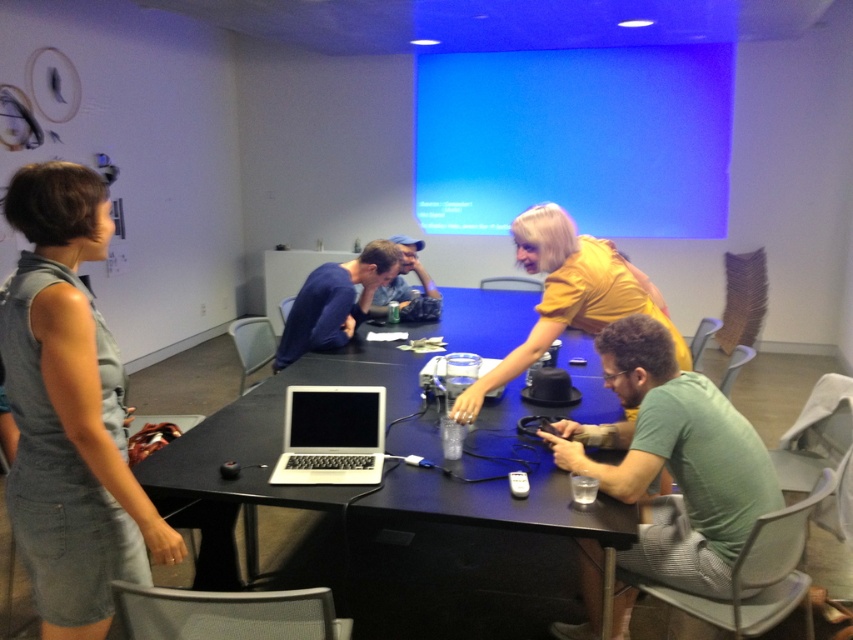
You are an office assistant who needs to place a new document on the black plastic table at center. However, there is a denim jacket at center in the way. Can you place the document directly on the table without moving the jacket?

The black plastic table at center is located below denim jacket at center, so the denim jacket is on top of the table. Therefore, you cannot place the document directly on the table without moving the jacket.

You are a person who wants to place a 15 cm tall object on the surface of the black plastic table at center. However, there is a clear plastic projector at center on the table. Will the object fit on the table without being blocked by the projector?

The black plastic table at center is much taller than the clear plastic projector at center, so placing a 15 cm tall object on the table surface would not be blocked by the projector since the table itself is taller. However, the actual space availability depends on the horizontal placement and not the vertical height difference.

You are an office worker who needs to present a slide show. You see the black plastic table at center and the clear plastic projector at center. Where should you place your laptop to connect it to the projector?

You should place your laptop on the black plastic table at center because it is below the clear plastic projector at center, which allows for easier cable connection.